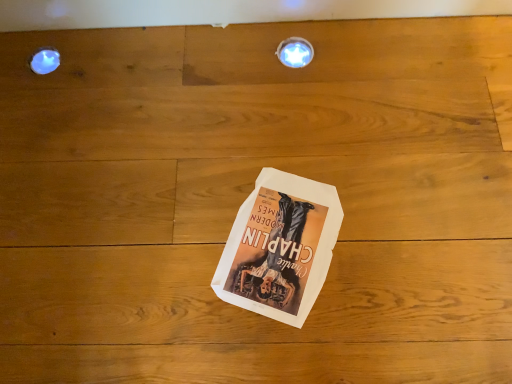
Question: Is matte white droplight at upper left looking in the opposite direction of white paper at center?

Choices:
 (A) yes
 (B) no

Answer: (B)

Question: Is matte white droplight at upper left smaller than white paper at center?

Choices:
 (A) yes
 (B) no

Answer: (A)

Question: Considering the relative sizes of matte white droplight at upper left and white paper at center in the image provided, is matte white droplight at upper left taller than white paper at center?

Choices:
 (A) yes
 (B) no

Answer: (A)

Question: Is matte white droplight at upper left positioned beyond the bounds of white paper at center?

Choices:
 (A) no
 (B) yes

Answer: (B)

Question: Is matte white droplight at upper left not near white paper at center?

Choices:
 (A) no
 (B) yes

Answer: (A)

Question: From the image's perspective, is white paper at center positioned above or below metallic circular light fixture at upper center?

Choices:
 (A) below
 (B) above

Answer: (A)

Question: Does point (336, 200) appear closer or farther from the camera than point (307, 41)?

Choices:
 (A) closer
 (B) farther

Answer: (A)

Question: Is white paper at center wider or thinner than metallic circular light fixture at upper center?

Choices:
 (A) wide
 (B) thin

Answer: (A)

Question: In terms of height, does white paper at center look taller or shorter compared to metallic circular light fixture at upper center?

Choices:
 (A) tall
 (B) short

Answer: (B)

Question: Relative to white paper at center, is matte white droplight at upper left in front or behind?

Choices:
 (A) front
 (B) behind

Answer: (B)

Question: Is point (49, 49) closer or farther from the camera than point (249, 284)?

Choices:
 (A) closer
 (B) farther

Answer: (B)

Question: In terms of height, does matte white droplight at upper left look taller or shorter compared to white paper at center?

Choices:
 (A) tall
 (B) short

Answer: (A)

Question: Based on their sizes in the image, would you say matte white droplight at upper left is bigger or smaller than white paper at center?

Choices:
 (A) small
 (B) big

Answer: (A)

Question: Is metallic circular light fixture at upper center to the left or to the right of matte white droplight at upper left in the image?

Choices:
 (A) right
 (B) left

Answer: (A)

Question: From a real-world perspective, is metallic circular light fixture at upper center above or below matte white droplight at upper left?

Choices:
 (A) above
 (B) below

Answer: (A)